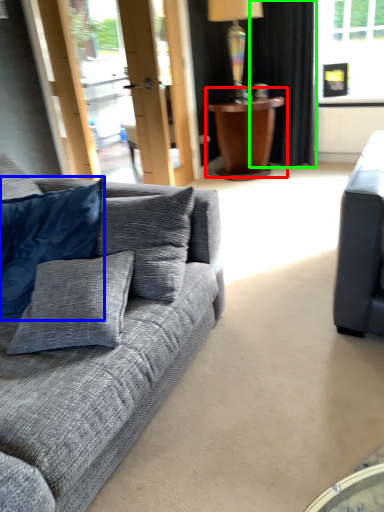
Question: Which is farther away from table (highlighted by a red box)? pillow (highlighted by a blue box) or curtain (highlighted by a green box)?

Choices:
 (A) pillow
 (B) curtain

Answer: (A)